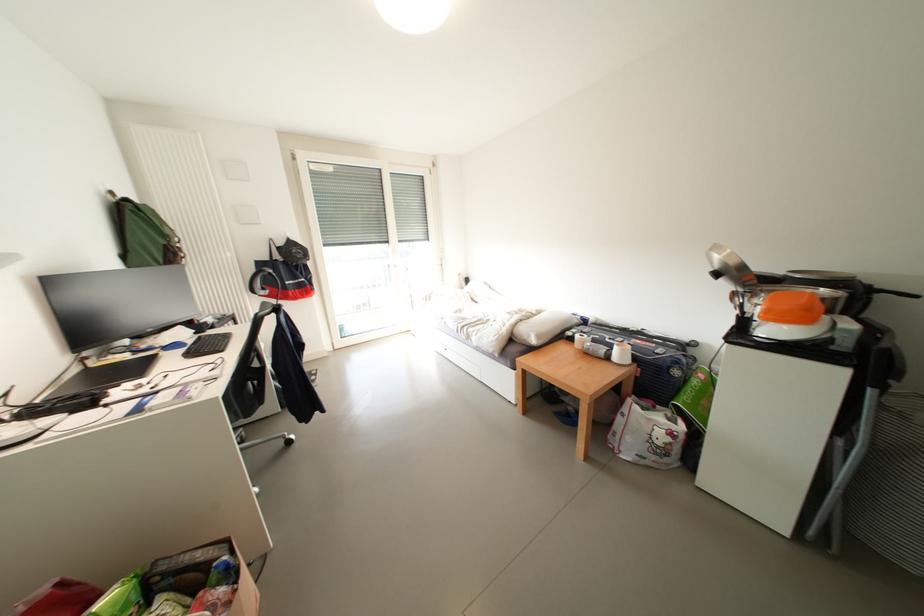
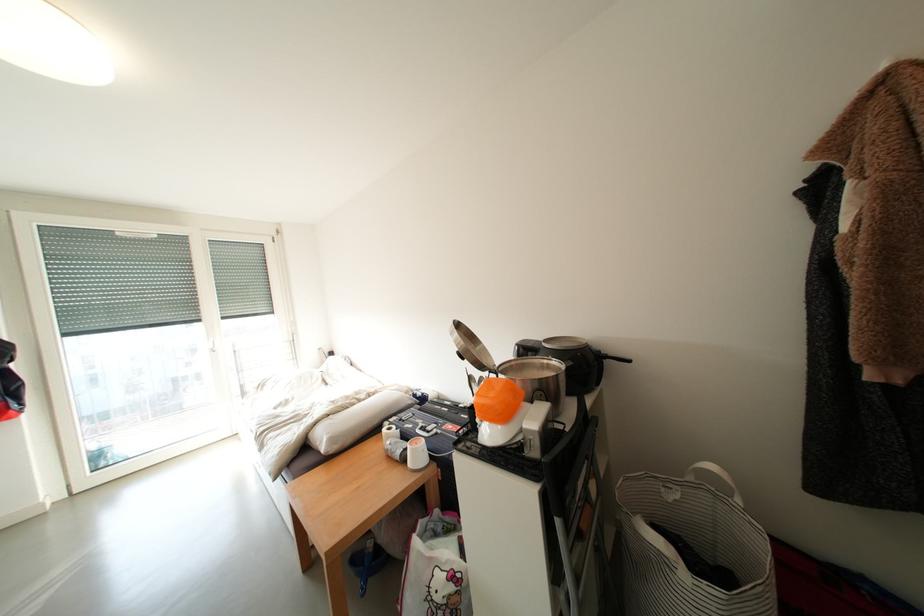
Find the pixel in the second image that matches (x=647, y=345) in the first image.

(457, 430)